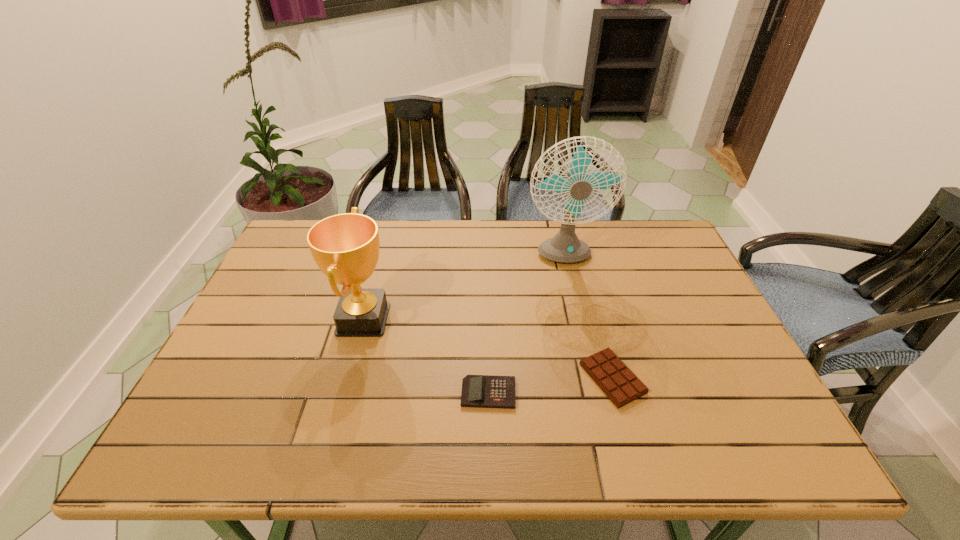
Image resolution: width=960 pixels, height=540 pixels. Find the location of `the tallest object`. the tallest object is located at coordinates (565, 247).

Where is `the farthest object`? the farthest object is located at coordinates (565, 247).

Find the location of a particular element. the leftmost object is located at coordinates (346, 246).

Where is `award`? This screenshot has height=540, width=960. award is located at coordinates (346, 246).

At what (x,y) coordinates should I click in order to perform the action: click on the third object from right to left. Please return your answer as a coordinate pair (x, y). Looking at the image, I should click on (481, 391).

Find the location of a particular element. This screenshot has height=540, width=960. candy bar is located at coordinates (614, 378).

This screenshot has height=540, width=960. I want to click on free point located on the front-facing side of the farthest object, so (589, 375).

The height and width of the screenshot is (540, 960). I want to click on blank space located 0.390m on the front-facing side of the leftmost object, so click(x=540, y=319).

Find the location of a particular element. This screenshot has width=960, height=540. vacant position located on the right of the second object from left to right is located at coordinates (556, 393).

I want to click on vacant space located 0.210m on the back of the candy bar, so click(589, 293).